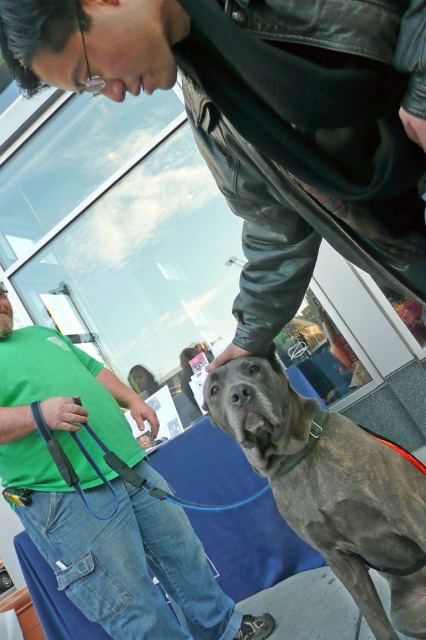
You are standing in the room and see two points marked in the image. Which point is closer to you, point (x=78, y=456) or point (x=78, y=406)?

Point (x=78, y=406) is closer to you because it is less further to the camera than point (x=78, y=456).

You are standing at the point labeled point (49, 452) and want to move to the point labeled point (291, 454). Is there a clear path between these two points without needing to go around any obstacles?

The path between point (49, 452) and point (291, 454) is clear because point (49, 452) is behind point (291, 454), so you can move directly towards it without obstacles.